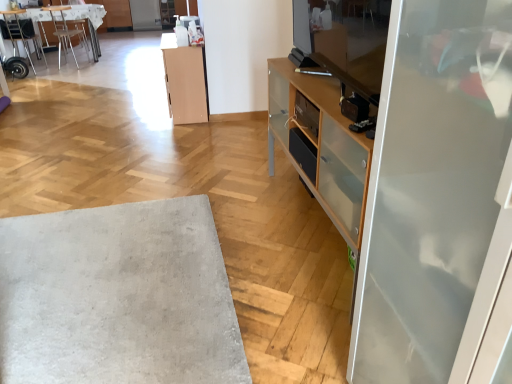
What is the approximate height of metallic silver chair at upper left, the 2th chair positioned from the right?

metallic silver chair at upper left, the 2th chair positioned from the right, is 31.26 inches tall.

Locate an element on the screen. transparent glass screen door at right, the 2th screen door from the left is located at coordinates (433, 190).

Locate an element on the screen. The height and width of the screenshot is (384, 512). metallic silver chair at upper left, which ranks as the first chair in right-to-left order is located at coordinates (66, 31).

From the picture: From their relative heights in the image, would you say metallic silver chair at upper left, the first chair viewed from the left, is taller or shorter than clear glass screen door at upper center, which is the second screen door from bottom to top?

metallic silver chair at upper left, the first chair viewed from the left, is taller than clear glass screen door at upper center, which is the second screen door from bottom to top.

Is metallic silver chair at upper left, the 2th chair positioned from the right, in front of or behind clear glass screen door at upper center, which is the 1th screen door in back-to-front order, in the image?

metallic silver chair at upper left, the 2th chair positioned from the right, is in front of clear glass screen door at upper center, which is the 1th screen door in back-to-front order.

The width and height of the screenshot is (512, 384). I want to click on chair that is the 2nd one when counting leftward from the clear glass screen door at upper center, which is the second screen door from bottom to top, so click(x=20, y=33).

From the image's perspective, is metallic silver chair at upper left, the 2th chair positioned from the right, below clear glass screen door at upper center, which is the second screen door in right-to-left order?

Yes, from the image's perspective, metallic silver chair at upper left, the 2th chair positioned from the right, is beneath clear glass screen door at upper center, which is the second screen door in right-to-left order.

From a real-world perspective, is clear glass screen door at upper center, marked as the 2th screen door in a front-to-back arrangement, above or below metallic silver chair at upper left, which ranks as the first chair in right-to-left order?

In terms of real-world spatial position, clear glass screen door at upper center, marked as the 2th screen door in a front-to-back arrangement, is below metallic silver chair at upper left, which ranks as the first chair in right-to-left order.

Is clear glass screen door at upper center, which ranks as the 1th screen door in top-to-bottom order, touching metallic silver chair at upper left, which ranks as the 2th chair in left-to-right order?

No.

Which object is thinner, clear glass screen door at upper center, which is the second screen door from bottom to top, or metallic silver chair at upper left, which ranks as the 2th chair in left-to-right order?

With smaller width is metallic silver chair at upper left, which ranks as the 2th chair in left-to-right order.

Is clear glass screen door at upper center, which ranks as the 1th screen door in top-to-bottom order, at the left side of metallic silver chair at upper left, which ranks as the first chair in right-to-left order?

Incorrect, clear glass screen door at upper center, which ranks as the 1th screen door in top-to-bottom order, is not on the left side of metallic silver chair at upper left, which ranks as the first chair in right-to-left order.

Are wooden textured desk at upper left and clear glass screen door at upper center, which is the second screen door in right-to-left order, far apart?

Yes, wooden textured desk at upper left and clear glass screen door at upper center, which is the second screen door in right-to-left order, are located far from each other.

Which of these two, wooden textured desk at upper left or clear glass screen door at upper center, which is the second screen door in right-to-left order, stands taller?

→ wooden textured desk at upper left.

Considering the sizes of objects wooden textured desk at upper left and clear glass screen door at upper center, acting as the first screen door starting from the left, in the image provided, who is bigger, wooden textured desk at upper left or clear glass screen door at upper center, acting as the first screen door starting from the left,?

With larger size is wooden textured desk at upper left.

Which object is further away from the camera taking this photo, transparent glass screen door at right, the 1th screen door positioned from the right, or metallic silver chair at upper left, the 2th chair positioned from the right?

Positioned behind is metallic silver chair at upper left, the 2th chair positioned from the right.

Considering the sizes of objects transparent glass screen door at right, the 2th screen door when ordered from top to bottom, and metallic silver chair at upper left, the first chair viewed from the left, in the image provided, who is thinner, transparent glass screen door at right, the 2th screen door when ordered from top to bottom, or metallic silver chair at upper left, the first chair viewed from the left,?

metallic silver chair at upper left, the first chair viewed from the left.

Is metallic silver chair at upper left, the first chair viewed from the left, completely or partially inside transparent glass screen door at right, which appears as the 1th screen door when ordered from the bottom?

No, metallic silver chair at upper left, the first chair viewed from the left, is located outside of transparent glass screen door at right, which appears as the 1th screen door when ordered from the bottom.

Can you tell me how much metallic silver chair at upper left, the 2th chair positioned from the right, and white soft rug at lower left differ in facing direction?

There is a 84.1-degree angle between the facing directions of metallic silver chair at upper left, the 2th chair positioned from the right, and white soft rug at lower left.

Is metallic silver chair at upper left, the first chair viewed from the left, to the right of white soft rug at lower left from the viewer's perspective?

In fact, metallic silver chair at upper left, the first chair viewed from the left, is to the left of white soft rug at lower left.

Considering the sizes of objects metallic silver chair at upper left, the 2th chair positioned from the right, and white soft rug at lower left in the image provided, who is bigger, metallic silver chair at upper left, the 2th chair positioned from the right, or white soft rug at lower left?

Bigger between the two is metallic silver chair at upper left, the 2th chair positioned from the right.

From the image's perspective, does clear glass screen door at upper center, marked as the 2th screen door in a front-to-back arrangement, appear higher than light wood cabinet at center?

Yes.

Which of these two, clear glass screen door at upper center, acting as the first screen door starting from the left, or light wood cabinet at center, stands shorter?

clear glass screen door at upper center, acting as the first screen door starting from the left, is shorter.

Is clear glass screen door at upper center, which is the second screen door in right-to-left order, located outside light wood cabinet at center?

Yes, clear glass screen door at upper center, which is the second screen door in right-to-left order, is located beyond the bounds of light wood cabinet at center.

Could you measure the distance between clear glass screen door at upper center, which is the second screen door in right-to-left order, and light wood cabinet at center?

clear glass screen door at upper center, which is the second screen door in right-to-left order, is 17.85 feet away from light wood cabinet at center.

From the image's perspective, does wooden textured desk at upper left appear lower than light wood cabinet at center?

No, from the image's perspective, wooden textured desk at upper left is not below light wood cabinet at center.

Which is in front, point (94, 29) or point (204, 66)?

The point (204, 66) is in front.

Which is more to the left, wooden textured desk at upper left or light wood cabinet at center?

From the viewer's perspective, wooden textured desk at upper left appears more on the left side.

Can you confirm if wooden textured desk at upper left is bigger than light wood cabinet at center?

Yes.

Find the location of a particular element. screen door lying above the metallic silver chair at upper left, the first chair viewed from the left (from the image's perspective) is located at coordinates (145, 15).

Where is `the 1st screen door counting from the right of the metallic silver chair at upper left, which ranks as the first chair in right-to-left order`? This screenshot has height=384, width=512. the 1st screen door counting from the right of the metallic silver chair at upper left, which ranks as the first chair in right-to-left order is located at coordinates (145, 15).

Looking at the image, which one is located further to wooden textured desk at upper left, light wood cabinet at center or transparent glass screen door at right, the 1th screen door positioned from the right?

Among the two, transparent glass screen door at right, the 1th screen door positioned from the right, is located further to wooden textured desk at upper left.

Based on their spatial positions, is transparent glass screen door at right, which is counted as the first screen door, starting from the front, or clear glass screen door at upper center, which is the second screen door from bottom to top, further from wooden textured desk at upper left?

Among the two, transparent glass screen door at right, which is counted as the first screen door, starting from the front, is located further to wooden textured desk at upper left.

Looking at the image, which one is located further to clear glass screen door at upper center, marked as the 2th screen door in a front-to-back arrangement, light wood cabinet at center or metallic silver chair at upper left, which ranks as the first chair in right-to-left order?

The object further to clear glass screen door at upper center, marked as the 2th screen door in a front-to-back arrangement, is light wood cabinet at center.

From the image, which object appears to be nearer to light wood cabinet at center, wooden textured desk at upper left or metallic silver chair at upper left, which ranks as the first chair in right-to-left order?

wooden textured desk at upper left is positioned closer to the anchor light wood cabinet at center.

From the image, which object appears to be farther from transparent glass screen door at right, the 1th screen door positioned from the right, white soft rug at lower left or clear glass screen door at upper center, which is the second screen door from bottom to top?

clear glass screen door at upper center, which is the second screen door from bottom to top, is positioned further to the anchor transparent glass screen door at right, the 1th screen door positioned from the right.

Looking at the image, which one is located closer to transparent glass screen door at right, the 1th screen door positioned from the right, light wood cabinet at center or white soft rug at lower left?

white soft rug at lower left.

Consider the image. Based on their spatial positions, is metallic silver chair at upper left, the first chair viewed from the left, or clear glass screen door at upper center, which is the second screen door in right-to-left order, further from transparent glass screen door at right, which is counted as the first screen door, starting from the front?

Among the two, clear glass screen door at upper center, which is the second screen door in right-to-left order, is located further to transparent glass screen door at right, which is counted as the first screen door, starting from the front.

When comparing their distances from white soft rug at lower left, does transparent glass screen door at right, the 1th screen door positioned from the right, or metallic silver chair at upper left, which ranks as the first chair in right-to-left order, seem further?

Based on the image, metallic silver chair at upper left, which ranks as the first chair in right-to-left order, appears to be further to white soft rug at lower left.

You are a GUI agent. You are given a task and a screenshot of the screen. Output one action in this format:
    pyautogui.click(x=<x>, y=<y>)
    Task: Click on the desk between transparent glass screen door at right, the 2th screen door from the left, and clear glass screen door at upper center, which is the 1th screen door in back-to-front order, in the front-back direction
    This screenshot has width=512, height=384.
    Given the screenshot: What is the action you would take?
    pyautogui.click(x=89, y=21)

The height and width of the screenshot is (384, 512). In order to click on cabinetry located between white soft rug at lower left and clear glass screen door at upper center, acting as the first screen door starting from the left, in the depth direction in this screenshot , I will do `click(184, 81)`.

This screenshot has width=512, height=384. In order to click on table located between transparent glass screen door at right, the second screen door positioned from the back, and light wood cabinet at center in the depth direction in this screenshot , I will do `click(118, 297)`.

Find the location of a particular element. The height and width of the screenshot is (384, 512). cabinetry between transparent glass screen door at right, the 2th screen door from the left, and metallic silver chair at upper left, the first chair viewed from the left, from front to back is located at coordinates (184, 81).